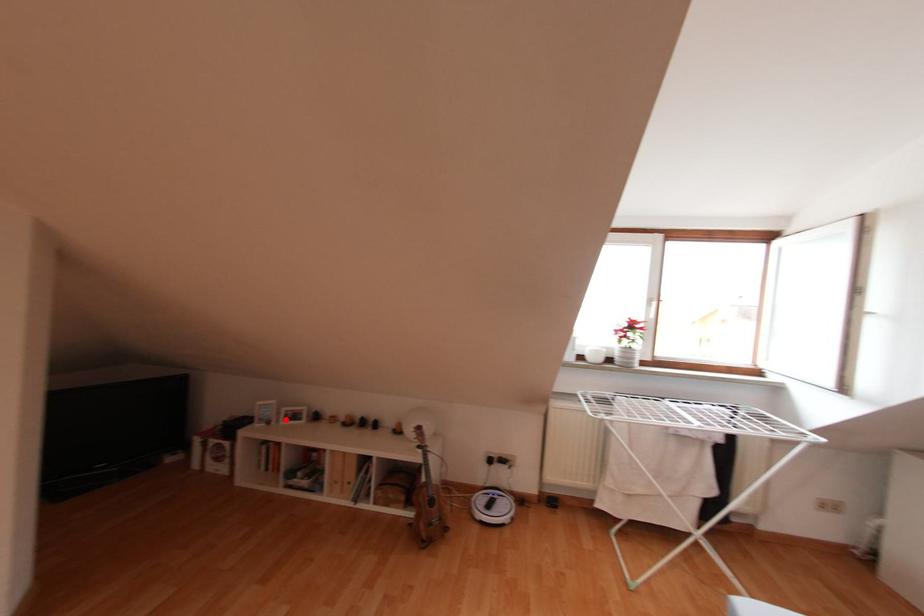
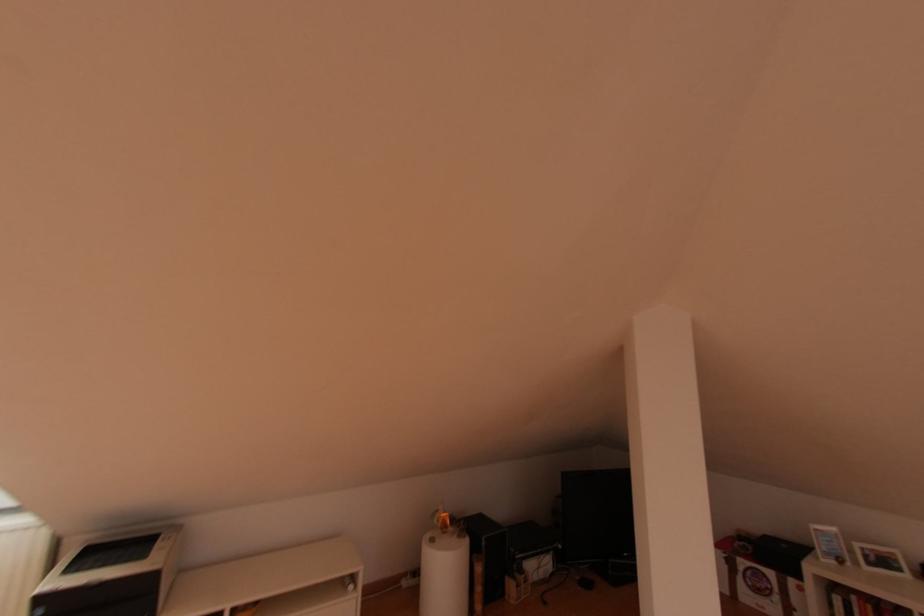
Question: I am providing you with two images of the same scene from different viewpoints. Image1 has a red point marked. In image2, the corresponding 3D location appears at what relative position? Reply with the corresponding letter.

Choices:
 (A) Closer
 (B) Farther

Answer: (A)